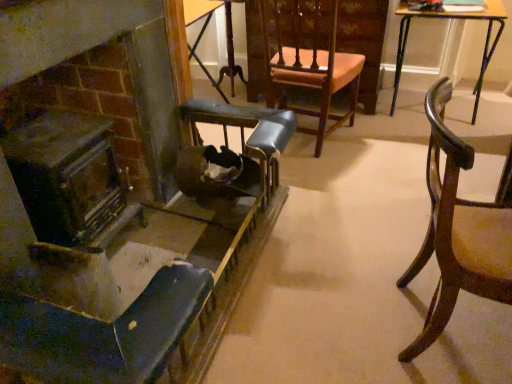
Question: Which direction should I rotate to look at wooden table at center, which is the 2th table in right-to-left order, — up or down?

Choices:
 (A) up
 (B) down

Answer: (A)

Question: Considering the relative sizes of wooden table at upper right, which ranks as the 2th table in left-to-right order, and dark brown wood fireplace at left in the image provided, is wooden table at upper right, which ranks as the 2th table in left-to-right order, thinner than dark brown wood fireplace at left?

Choices:
 (A) no
 (B) yes

Answer: (B)

Question: From a real-world perspective, is wooden table at upper right, which ranks as the 1th table in right-to-left order, over dark brown wood fireplace at left?

Choices:
 (A) yes
 (B) no

Answer: (B)

Question: Can you confirm if wooden table at upper right, which ranks as the 2th table in left-to-right order, is positioned to the right of dark brown wood fireplace at left?

Choices:
 (A) yes
 (B) no

Answer: (A)

Question: Is wooden table at upper right, which ranks as the 1th table in right-to-left order, shorter than dark brown wood fireplace at left?

Choices:
 (A) yes
 (B) no

Answer: (A)

Question: From the image's perspective, would you say wooden table at upper right, which ranks as the 2th table in left-to-right order, is shown under dark brown wood fireplace at left?

Choices:
 (A) yes
 (B) no

Answer: (B)

Question: Is wooden table at upper right, which ranks as the 2th table in left-to-right order, at the left side of dark brown wood fireplace at left?

Choices:
 (A) no
 (B) yes

Answer: (A)

Question: Does wooden chair with upholstered seat at center, the 2th chair positioned from the right, have a smaller size compared to wooden table at upper right, which ranks as the 2th table in left-to-right order?

Choices:
 (A) no
 (B) yes

Answer: (B)

Question: Does wooden chair with upholstered seat at center, the 2th chair positioned from the left, come in front of wooden table at upper right, which ranks as the 1th table in right-to-left order?

Choices:
 (A) no
 (B) yes

Answer: (B)

Question: Is wooden chair with upholstered seat at center, the 2th chair positioned from the right, turned away from wooden table at upper right, which ranks as the 2th table in left-to-right order?

Choices:
 (A) yes
 (B) no

Answer: (B)

Question: Does wooden chair with upholstered seat at center, the 2th chair positioned from the right, have a lesser width compared to wooden table at upper right, which ranks as the 2th table in left-to-right order?

Choices:
 (A) yes
 (B) no

Answer: (A)

Question: Is wooden chair with upholstered seat at center, the 2th chair positioned from the right, not inside wooden table at upper right, which ranks as the 2th table in left-to-right order?

Choices:
 (A) yes
 (B) no

Answer: (A)

Question: From the image's perspective, is wooden chair with upholstered seat at center, the 2th chair positioned from the right, located beneath wooden table at upper right, which ranks as the 1th table in right-to-left order?

Choices:
 (A) no
 (B) yes

Answer: (B)

Question: From a real-world perspective, is wooden table at center, marked as the 1th table in a left-to-right arrangement, located beneath wooden chair with upholstered seat at center, the 2th chair positioned from the left?

Choices:
 (A) yes
 (B) no

Answer: (A)